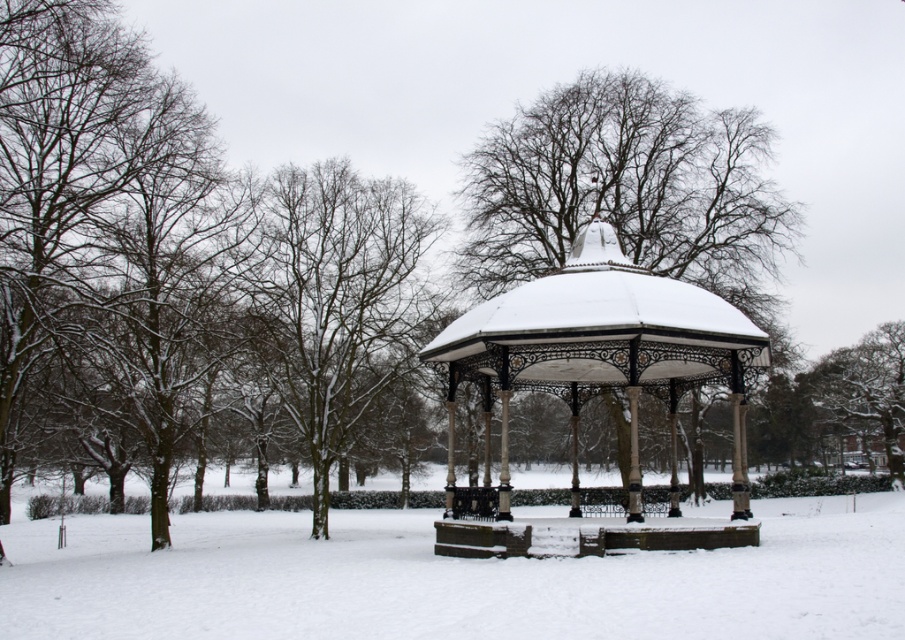
Is snow-covered metal gazebo at center bigger than snow-covered tree at right?

Indeed, snow-covered metal gazebo at center has a larger size compared to snow-covered tree at right.

Between snow-covered metal gazebo at center and snow-covered tree at right, which one is positioned lower?

Positioned lower is snow-covered tree at right.

Which is behind, point (656, 545) or point (855, 420)?

The point (855, 420) is more distant.

At what (x,y) coordinates should I click in order to perform the action: click on snow-covered metal gazebo at center. Please return your answer as a coordinate pair (x, y). Image resolution: width=905 pixels, height=640 pixels. Looking at the image, I should click on (599, 352).

Can you confirm if white powdery snow at center is bigger than snow-covered branches at left?

Correct, white powdery snow at center is larger in size than snow-covered branches at left.

Does white powdery snow at center come in front of snow-covered branches at left?

Yes, it is in front of snow-covered branches at left.

Is point (834, 538) positioned in front of point (274, 179)?

Yes, it is.

This screenshot has height=640, width=905. I want to click on white powdery snow at center, so click(449, 579).

Between white powdery snow at center and snow-covered tree at right, which one has more height?

snow-covered tree at right is taller.

Does point (154, 604) lie behind point (817, 397)?

No, (154, 604) is closer to viewer.

At what (x,y) coordinates should I click in order to perform the action: click on white powdery snow at center. Please return your answer as a coordinate pair (x, y). Image resolution: width=905 pixels, height=640 pixels. Looking at the image, I should click on (449, 579).